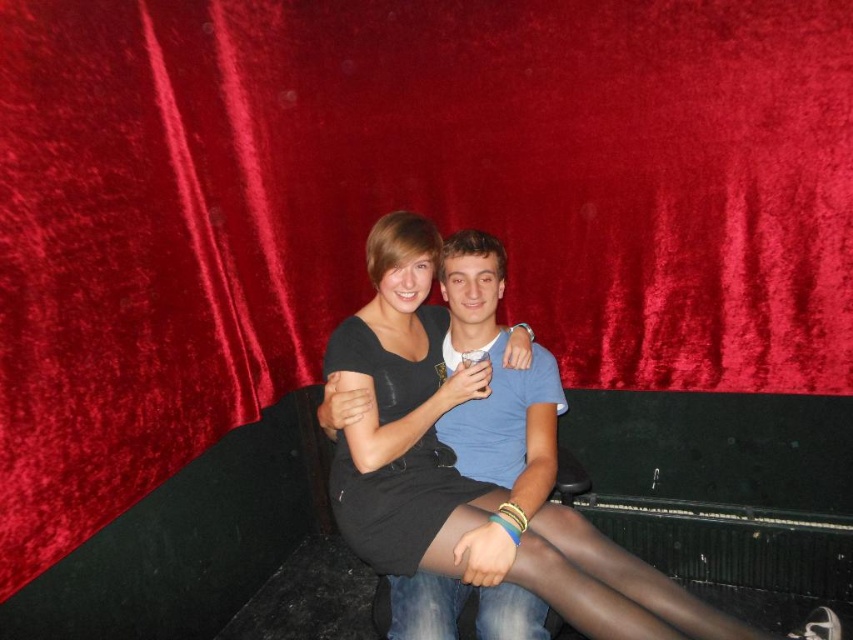
Does matte black dress at center have a greater width compared to black matte tights at center?

Correct, the width of matte black dress at center exceeds that of black matte tights at center.

What do you see at coordinates (494, 465) in the screenshot?
I see `matte black dress at center` at bounding box center [494, 465].

Locate an element on the screen. This screenshot has width=853, height=640. matte black dress at center is located at coordinates (494, 465).

Is black matte dress at center to the right of black matte tights at center from the viewer's perspective?

Incorrect, black matte dress at center is not on the right side of black matte tights at center.

Between black matte dress at center and black matte tights at center, which one appears on the right side from the viewer's perspective?

Positioned to the right is black matte tights at center.

Find the location of a particular element. black matte dress at center is located at coordinates (445, 429).

This screenshot has width=853, height=640. Identify the location of black matte dress at center. (445, 429).

Between black matte dress at center and matte black dress at center, which one has more height?

matte black dress at center

You are a GUI agent. You are given a task and a screenshot of the screen. Output one action in this format:
    pyautogui.click(x=<x>, y=<y>)
    Task: Click on the black matte dress at center
    This screenshot has height=640, width=853.
    Given the screenshot: What is the action you would take?
    pyautogui.click(x=445, y=429)